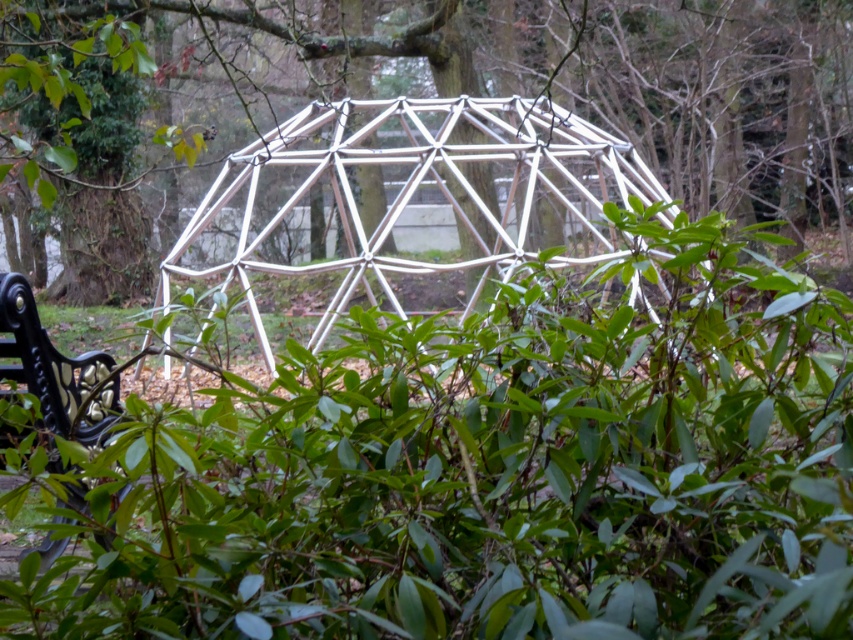
You are a park visitor sitting on the black bench on the left. You notice the green matte bush at center and the green leafy tree at center. Which one is closer to the ground?

The green matte bush at center is closer to the ground because it is positioned below the green leafy tree at center.

Based on the photo, you are standing in the park near the geodesic dome. You want to place a 3D printed model of the dome on a table that is 6 feet away from you. The model needs to be placed exactly at the point corresponding to the real dome point at point (554, 474). Can you determine if the model placement will be accurate if the real point is 6.42 feet away from you?

The point (554, 474) is 6.42 feet away from you, which is slightly farther than the table that is 6 feet away. Therefore, the model placement may not be accurate as the distances do not match.

You are standing in the park near the geodesic dome. You want to know if you can reach a point marked at coordinates point (787, 150) without crossing the dome structure. The dome has a radius of 30 feet. Can you do it?

The distance between you and point (787, 150) is 61.39 feet. Since the dome has a radius of 30 feet, the maximum distance across the dome would be 60 feet. Therefore, you can reach the point without crossing the dome structure because the distance is slightly more than the dome diameter.